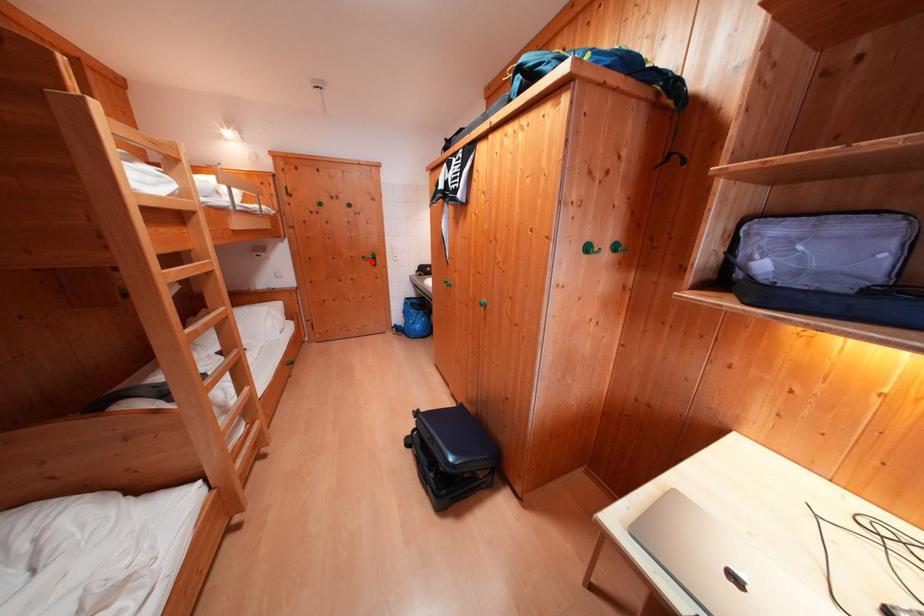
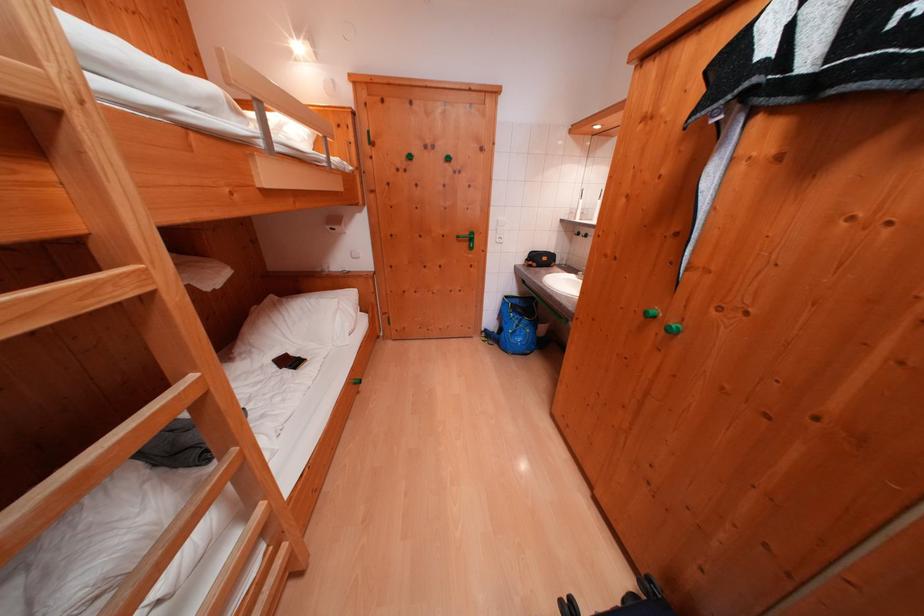
Find the pixel in the second image that matches the highlighted location in the first image.

(466, 241)